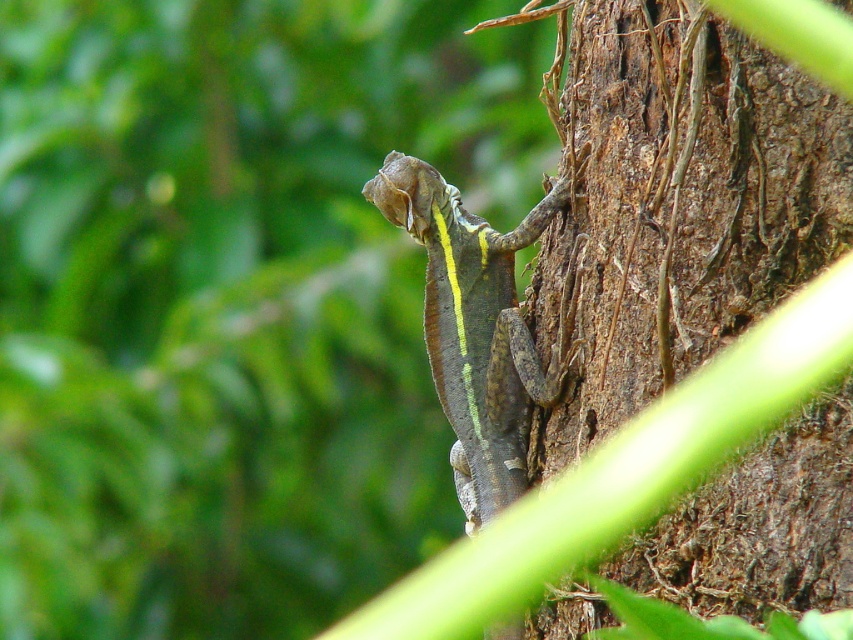
Question: Is brown rough bark at center in front of shiny green scales at center?

Choices:
 (A) no
 (B) yes

Answer: (B)

Question: Which point is closer to the camera?

Choices:
 (A) (488, 280)
 (B) (579, 232)

Answer: (B)

Question: In this image, where is brown rough bark at center located relative to shiny green scales at center?

Choices:
 (A) right
 (B) left

Answer: (A)

Question: Can you confirm if brown rough bark at center is wider than shiny green scales at center?

Choices:
 (A) yes
 (B) no

Answer: (A)

Question: Which object appears farthest from the camera in this image?

Choices:
 (A) shiny green scales at center
 (B) brown rough bark at center

Answer: (A)